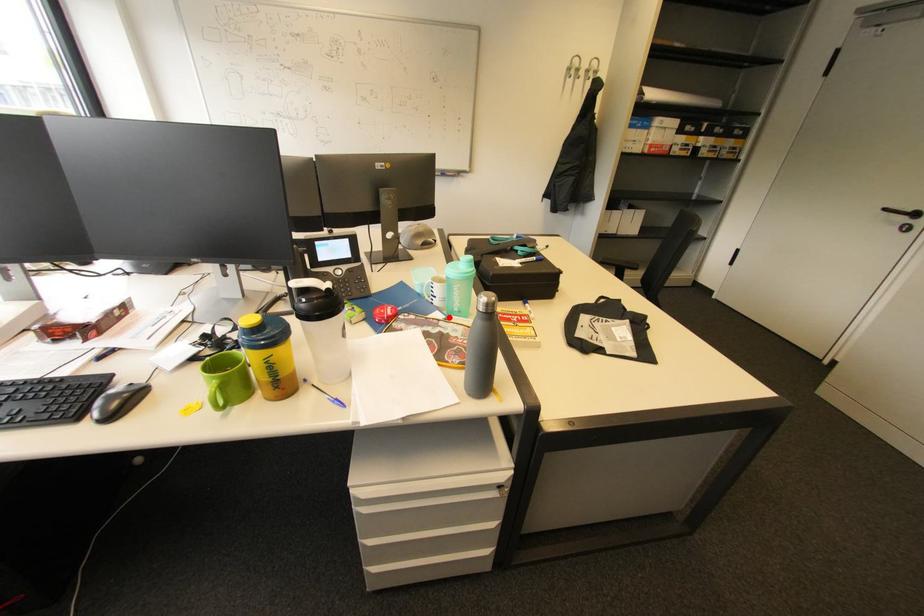
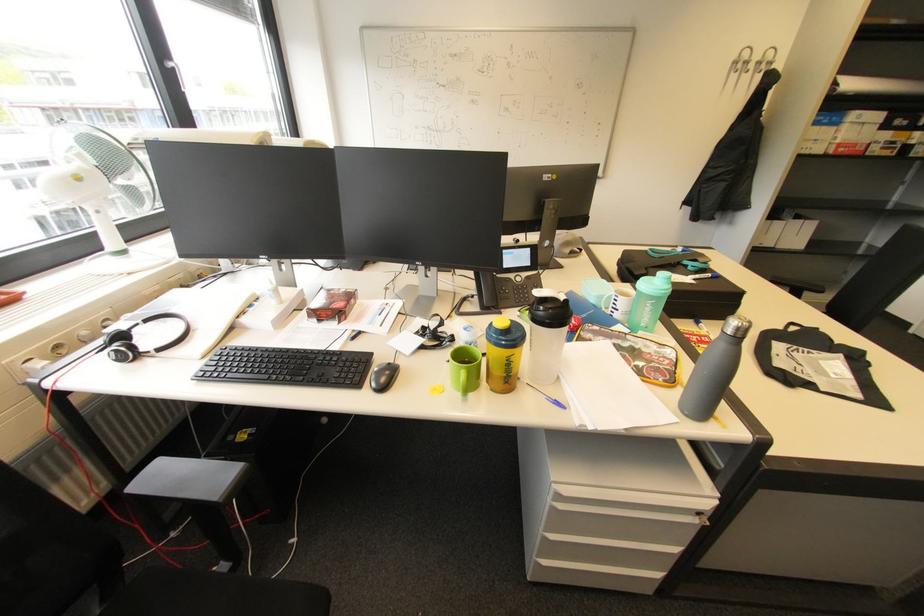
Locate, in the second image, the point that corresponds to the highlighted location in the first image.

(635, 331)